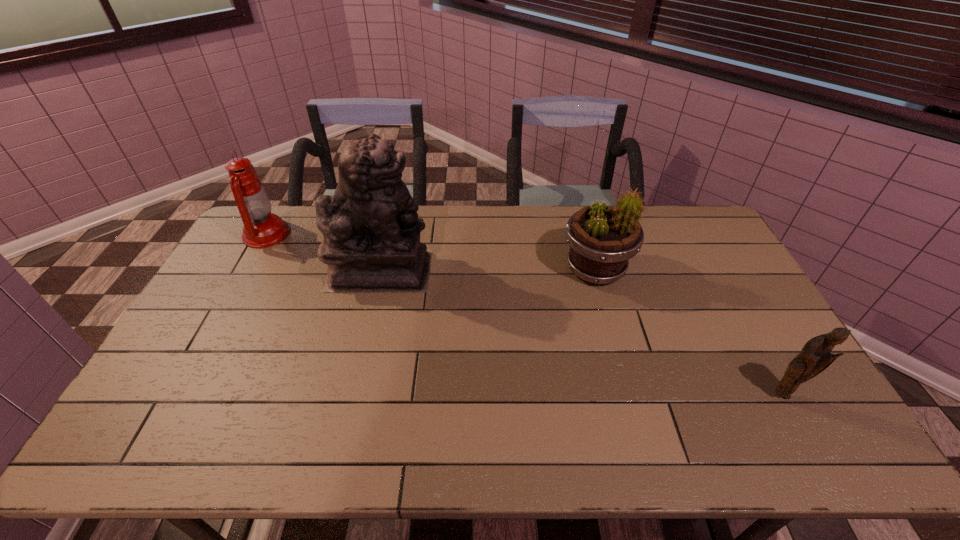
In order to click on the tallest object in this screenshot , I will do `click(371, 231)`.

You are a GUI agent. You are given a task and a screenshot of the screen. Output one action in this format:
    pyautogui.click(x=<x>, y=<y>)
    Task: Click on the third object from right to left
    The image size is (960, 540).
    Given the screenshot: What is the action you would take?
    pyautogui.click(x=371, y=231)

You are a GUI agent. You are given a task and a screenshot of the screen. Output one action in this format:
    pyautogui.click(x=<x>, y=<y>)
    Task: Click on the oil lamp
    This screenshot has height=540, width=960.
    Given the screenshot: What is the action you would take?
    [262, 229]

At what (x,y) coordinates should I click in order to perform the action: click on the third object from left to right. Please return your answer as a coordinate pair (x, y). This screenshot has width=960, height=540. Looking at the image, I should click on (602, 239).

I want to click on figurine, so click(x=815, y=357).

Find the location of `the shortest object`. the shortest object is located at coordinates tap(815, 357).

Where is `vacant space located 0.330m on the front-facing side of the tallest object`? Image resolution: width=960 pixels, height=540 pixels. vacant space located 0.330m on the front-facing side of the tallest object is located at coordinates (530, 270).

What are the coordinates of `free space located on the front of the oil lamp` in the screenshot? It's located at (220, 317).

Where is `vacant space located on the front of the second object from right to left`? Image resolution: width=960 pixels, height=540 pixels. vacant space located on the front of the second object from right to left is located at coordinates (634, 409).

Identify the location of vacant space located on the front-facing side of the rightmost object. 796,420.